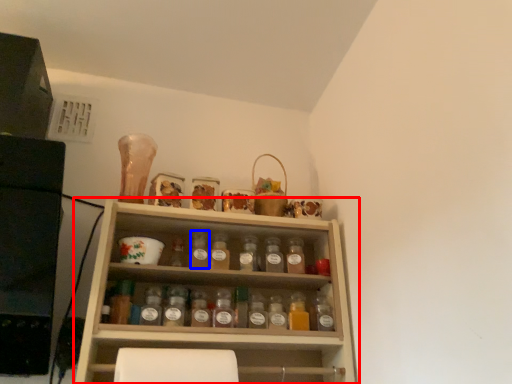
Question: Among these objects, which one is nearest to the camera, shelf (highlighted by a red box) or bottle (highlighted by a blue box)?

Choices:
 (A) shelf
 (B) bottle

Answer: (A)